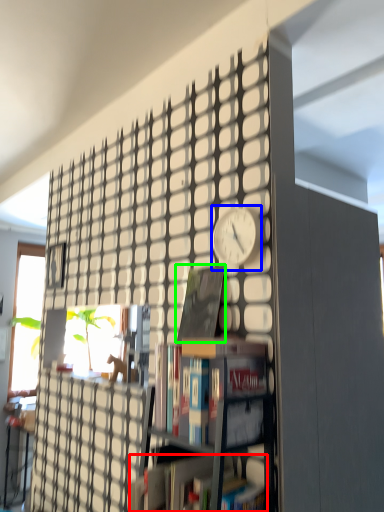
Question: Based on their relative distances, which object is nearer to book (highlighted by a red box)? Choose from clock (highlighted by a blue box) and book (highlighted by a green box).

Choices:
 (A) clock
 (B) book

Answer: (B)